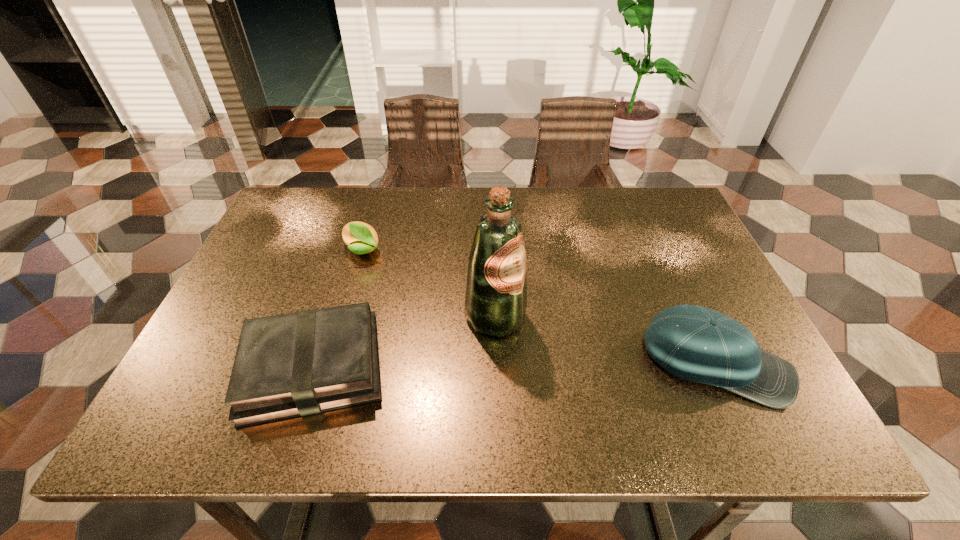
This screenshot has width=960, height=540. What are the coordinates of `object that is at the near right corner` in the screenshot? It's located at (695, 343).

What are the coordinates of `vacant space at the far edge` in the screenshot? It's located at (409, 213).

Image resolution: width=960 pixels, height=540 pixels. I want to click on vacant space at the near edge of the desktop, so click(477, 375).

In the image, there is a desktop. Identify the location of vacant space at the left edge. (298, 250).

Image resolution: width=960 pixels, height=540 pixels. I want to click on vacant space at the right edge, so click(668, 255).

Locate an element on the screen. The height and width of the screenshot is (540, 960). free region at the far right corner of the desktop is located at coordinates (662, 225).

Locate an element on the screen. free space between the rightmost object and the lemon is located at coordinates (540, 307).

Find the location of `free space between the tallest object and the shortest object`. free space between the tallest object and the shortest object is located at coordinates (404, 343).

Identify the location of free point between the baseball cap and the shortest object. (515, 366).

The width and height of the screenshot is (960, 540). What are the coordinates of `empty space between the farthest object and the rightmost object` in the screenshot? It's located at (540, 307).